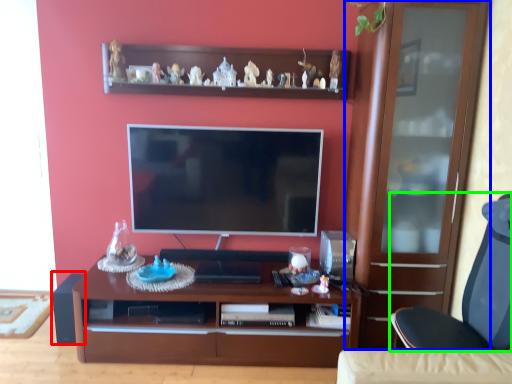
Question: Which is farther away from speaker (highlighted by a red box)? cabinetry (highlighted by a blue box) or chair (highlighted by a green box)?

Choices:
 (A) cabinetry
 (B) chair

Answer: (A)